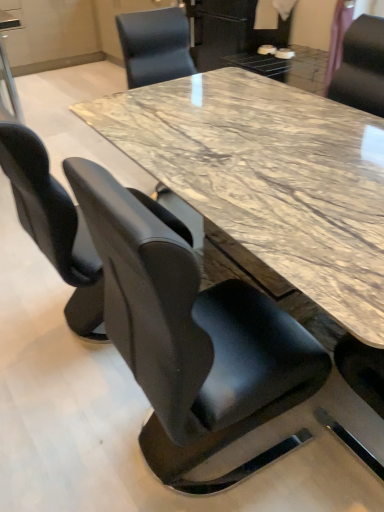
Question: Would you consider black leather chair at upper right, the first chair when ordered from back to front, to be distant from black leather chair at left, which ranks as the 2th chair in back-to-front order?

Choices:
 (A) no
 (B) yes

Answer: (B)

Question: From a real-world perspective, does black leather chair at upper right, positioned as the 3th chair in front-to-back order, stand above black leather chair at left, which ranks as the 2th chair in back-to-front order?

Choices:
 (A) no
 (B) yes

Answer: (B)

Question: Does black leather chair at upper right, acting as the 1th chair starting from the right, have a greater height compared to black leather chair at left, which ranks as the 2th chair in back-to-front order?

Choices:
 (A) yes
 (B) no

Answer: (B)

Question: Considering the relative sizes of black leather chair at upper right, which appears as the third chair when viewed from the left, and black leather chair at left, which is the 2th chair in front-to-back order, in the image provided, is black leather chair at upper right, which appears as the third chair when viewed from the left, bigger than black leather chair at left, which is the 2th chair in front-to-back order,?

Choices:
 (A) no
 (B) yes

Answer: (A)

Question: Does black leather chair at upper right, the first chair when ordered from back to front, lie behind black leather chair at left, which is the 2th chair in front-to-back order?

Choices:
 (A) yes
 (B) no

Answer: (A)

Question: Can you confirm if black leather chair at upper right, positioned as the 3th chair in front-to-back order, is positioned to the right of black leather chair at left, which is the 2th chair in front-to-back order?

Choices:
 (A) no
 (B) yes

Answer: (B)

Question: From a real-world perspective, is black leather chair at center, the 2th chair from the left, physically above black leather chair at left, which is the 2th chair in front-to-back order?

Choices:
 (A) yes
 (B) no

Answer: (B)

Question: Can you confirm if black leather chair at center, the third chair from the back, is bigger than black leather chair at left, which is the 2th chair in front-to-back order?

Choices:
 (A) yes
 (B) no

Answer: (B)

Question: Is black leather chair at left, which appears as the 1th chair when viewed from the left, a part of black leather chair at center, which is the 2th chair from right to left?

Choices:
 (A) no
 (B) yes

Answer: (A)

Question: Is black leather chair at center, the third chair from the back, closer to the viewer compared to black leather chair at left, which is the 2th chair in front-to-back order?

Choices:
 (A) no
 (B) yes

Answer: (B)

Question: Does black leather chair at center, the 1th chair when ordered from front to back, have a greater height compared to black leather chair at left, which appears as the 3th chair when viewed from the right?

Choices:
 (A) yes
 (B) no

Answer: (A)

Question: Is black leather chair at center, which is the 2th chair from right to left, touching black leather chair at left, which is the 2th chair in front-to-back order?

Choices:
 (A) no
 (B) yes

Answer: (A)

Question: Considering the relative sizes of black leather chair at upper right, which appears as the third chair when viewed from the left, and black leather chair at center, the third chair from the back, in the image provided, is black leather chair at upper right, which appears as the third chair when viewed from the left, wider than black leather chair at center, the third chair from the back,?

Choices:
 (A) yes
 (B) no

Answer: (B)